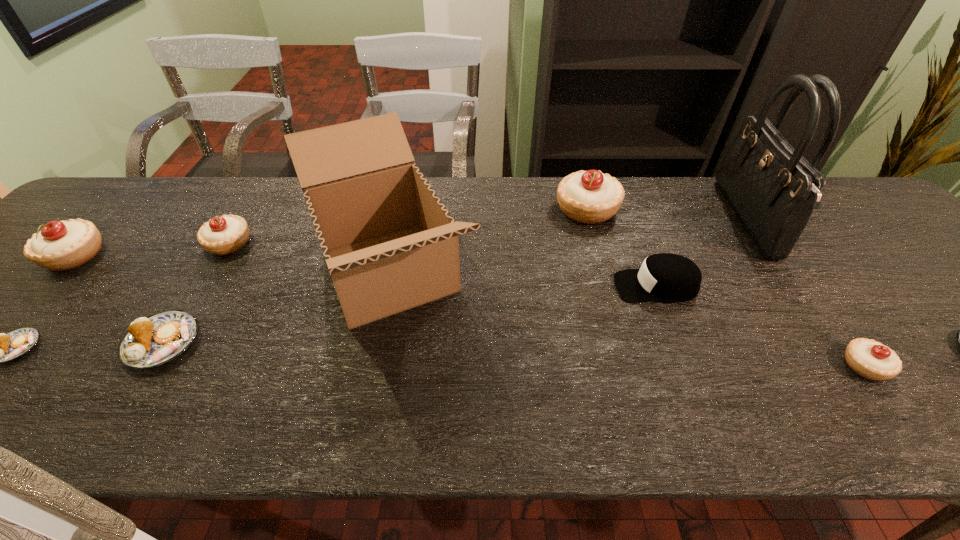
Where is `handbag`? Image resolution: width=960 pixels, height=540 pixels. handbag is located at coordinates (773, 189).

Image resolution: width=960 pixels, height=540 pixels. What are the coordinates of `the tallest object` in the screenshot? It's located at (773, 189).

At what (x,y) coordinates should I click in order to perform the action: click on the ninth shortest object. Please return your answer as a coordinate pair (x, y). The image size is (960, 540). Looking at the image, I should click on 390,245.

The image size is (960, 540). Identify the location of box. (390, 245).

I want to click on the third beige pastry from left to right, so [590, 197].

The width and height of the screenshot is (960, 540). Find the location of `the fifth pastry from left to right`. the fifth pastry from left to right is located at coordinates (590, 197).

You are a GUI agent. You are given a task and a screenshot of the screen. Output one action in this format:
    pyautogui.click(x=<x>, y=<y>)
    Task: Click on the second tallest pastry
    
    Given the screenshot: What is the action you would take?
    pyautogui.click(x=60, y=245)

The image size is (960, 540). What are the coordinates of `the leftmost beige pastry` in the screenshot? It's located at (60, 245).

This screenshot has height=540, width=960. What are the coordinates of `the third beige pastry from right to left` in the screenshot? It's located at (221, 235).

Where is `the fifth shortest pastry`? the fifth shortest pastry is located at coordinates (221, 235).